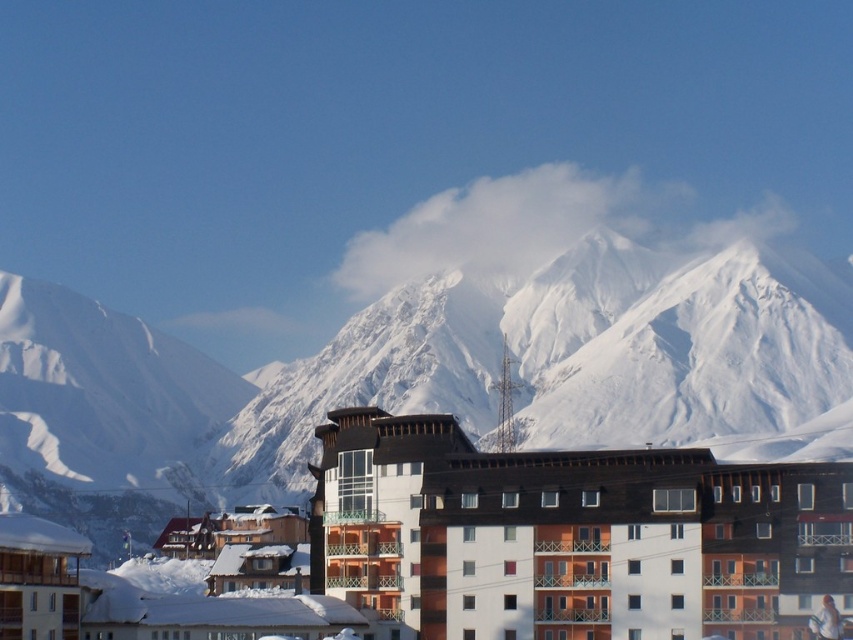
Question: Which object appears closest to the camera in this image?

Choices:
 (A) white wood apartment building at center
 (B) white snowboarder at center

Answer: (B)

Question: From the image, what is the correct spatial relationship of white snow-covered mountain at upper center in relation to white snowboarder at center?

Choices:
 (A) below
 (B) above

Answer: (B)

Question: Does white snow-covered mountain at upper center come in front of white wood apartment building at center?

Choices:
 (A) yes
 (B) no

Answer: (B)

Question: Which point is closer to the camera?

Choices:
 (A) (473, 285)
 (B) (323, 512)
 (C) (837, 628)

Answer: (C)

Question: Can you confirm if white wood apartment building at center is positioned above white snowboarder at center?

Choices:
 (A) no
 (B) yes

Answer: (B)

Question: Which object appears closest to the camera in this image?

Choices:
 (A) white wood apartment building at center
 (B) white snow-covered mountain at upper center

Answer: (A)